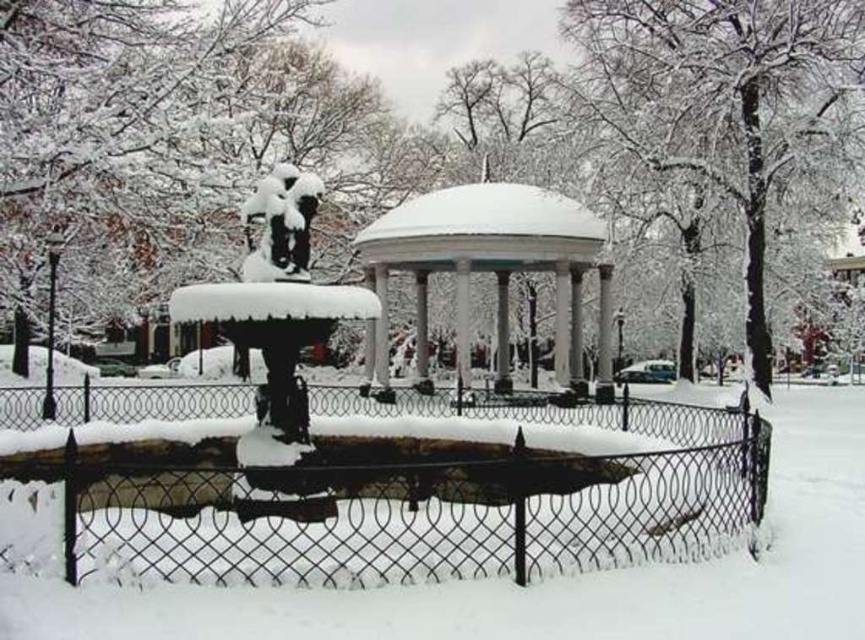
Question: Which of the following is the closest to the observer?

Choices:
 (A) (399, 474)
 (B) (494, 241)
 (C) (303, 273)

Answer: (C)

Question: Does black wire fence at center come in front of snow-covered statue at center?

Choices:
 (A) yes
 (B) no

Answer: (A)

Question: Which of the following is the farthest from the observer?

Choices:
 (A) snow-covered bronze statue at center
 (B) white glossy gazebo at center
 (C) snow-covered statue at center

Answer: (B)

Question: Which object appears closest to the camera in this image?

Choices:
 (A) snow-covered bronze statue at center
 (B) black wire fence at center
 (C) white glossy gazebo at center

Answer: (B)

Question: Considering the relative positions of snow-covered bronze statue at center and white glossy gazebo at center in the image provided, where is snow-covered bronze statue at center located with respect to white glossy gazebo at center?

Choices:
 (A) above
 (B) below

Answer: (B)

Question: Is snow-covered bronze statue at center wider than white glossy gazebo at center?

Choices:
 (A) no
 (B) yes

Answer: (A)